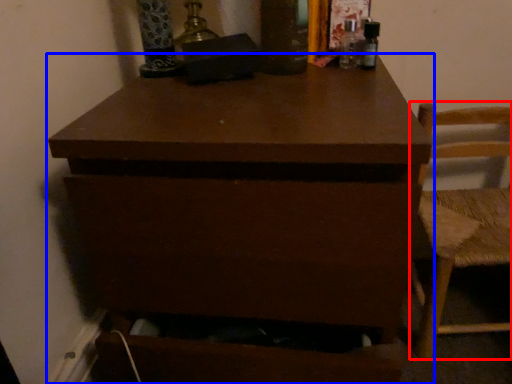
Question: Which of the following is the farthest to the observer, chair (highlighted by a red box) or chest of drawers (highlighted by a blue box)?

Choices:
 (A) chair
 (B) chest of drawers

Answer: (A)